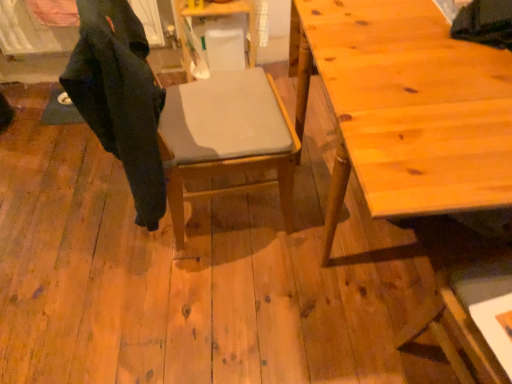
Question: Which direction should I rotate to face wooden table at center, acting as the 2th table starting from the front, — up or down?

Choices:
 (A) down
 (B) up

Answer: (B)

Question: Considering the relative sizes of wooden table at right, acting as the 2th table starting from the left, and dark matte fabric robe at left in the image provided, is wooden table at right, acting as the 2th table starting from the left, smaller than dark matte fabric robe at left?

Choices:
 (A) yes
 (B) no

Answer: (B)

Question: Can you confirm if wooden table at right, which is counted as the 1th table, starting from the front, is positioned to the right of dark matte fabric robe at left?

Choices:
 (A) yes
 (B) no

Answer: (A)

Question: Can you confirm if wooden table at right, the 2th table positioned from the top, is positioned to the left of dark matte fabric robe at left?

Choices:
 (A) yes
 (B) no

Answer: (B)

Question: From the image's perspective, is wooden table at right, which is counted as the 1th table, starting from the front, located beneath dark matte fabric robe at left?

Choices:
 (A) no
 (B) yes

Answer: (B)

Question: Is dark matte fabric robe at left at the back of wooden table at right, the first table positioned from the right?

Choices:
 (A) yes
 (B) no

Answer: (B)

Question: Is wooden table at right, the 2th table positioned from the top, not near dark matte fabric robe at left?

Choices:
 (A) no
 (B) yes

Answer: (A)

Question: From the image's perspective, is dark matte fabric robe at left beneath wooden table at right, the first table positioned from the right?

Choices:
 (A) no
 (B) yes

Answer: (A)

Question: Is dark matte fabric robe at left to the right of wooden table at right, which is the first table in bottom-to-top order, from the viewer's perspective?

Choices:
 (A) no
 (B) yes

Answer: (A)

Question: From a real-world perspective, is dark matte fabric robe at left physically below wooden table at right, acting as the 2th table starting from the left?

Choices:
 (A) no
 (B) yes

Answer: (A)

Question: Is dark matte fabric robe at left not near wooden table at right, which is the first table in bottom-to-top order?

Choices:
 (A) no
 (B) yes

Answer: (A)

Question: Does dark matte fabric robe at left have a greater height compared to wooden table at right, which is the first table in bottom-to-top order?

Choices:
 (A) yes
 (B) no

Answer: (B)

Question: Can you confirm if dark matte fabric robe at left is bigger than wooden table at right, which is counted as the 1th table, starting from the front?

Choices:
 (A) yes
 (B) no

Answer: (B)

Question: Is wooden table at right, the first table positioned from the right, turned away from matte gray cushion at center?

Choices:
 (A) no
 (B) yes

Answer: (A)